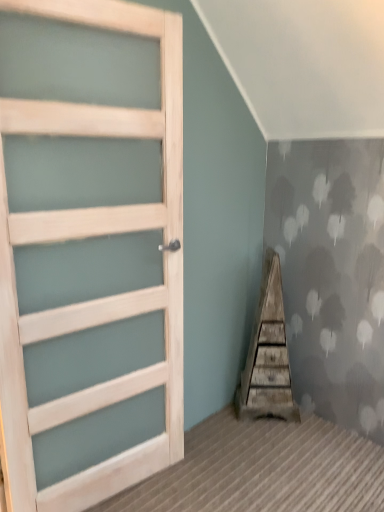
Describe the element at coordinates (268, 354) in the screenshot. I see `weathered wood stairwell at center` at that location.

This screenshot has width=384, height=512. Find the location of `weathered wood stairwell at center`. weathered wood stairwell at center is located at coordinates (268, 354).

In order to face light wood door at left, should I rotate leftwards or rightwards?

You should look left and rotate roughly 12.542 degrees.

This screenshot has height=512, width=384. What do you see at coordinates (89, 250) in the screenshot?
I see `light wood door at left` at bounding box center [89, 250].

Where is `light wood door at left`? light wood door at left is located at coordinates (89, 250).

What is the approximate height of light wood door at left?

The height of light wood door at left is 2.05 meters.

Where is `weathered wood stairwell at center`? The height and width of the screenshot is (512, 384). weathered wood stairwell at center is located at coordinates (268, 354).

Is weathered wood stairwell at center to the right of light wood door at left from the viewer's perspective?

Correct, you'll find weathered wood stairwell at center to the right of light wood door at left.

Does weathered wood stairwell at center lie behind light wood door at left?

Yes, the depth of weathered wood stairwell at center is greater than that of light wood door at left.

Is point (263, 304) closer or farther from the camera than point (68, 336)?

Point (263, 304) is positioned farther from the camera compared to point (68, 336).

From the image's perspective, is weathered wood stairwell at center on top of light wood door at left?

Incorrect, from the image's perspective, weathered wood stairwell at center is lower than light wood door at left.

From a real-world perspective, between weathered wood stairwell at center and light wood door at left, who is vertically higher?

light wood door at left.

Between weathered wood stairwell at center and light wood door at left, which one has smaller width?

With smaller width is light wood door at left.

Who is shorter, weathered wood stairwell at center or light wood door at left?

weathered wood stairwell at center.

Considering the sizes of objects weathered wood stairwell at center and light wood door at left in the image provided, who is smaller, weathered wood stairwell at center or light wood door at left?

weathered wood stairwell at center.

Would you say weathered wood stairwell at center is inside or outside light wood door at left?

The correct answer is: outside.

Looking at this image, is weathered wood stairwell at center with light wood door at left?

weathered wood stairwell at center is not next to light wood door at left, and they're not touching.

Could you tell me if weathered wood stairwell at center is turned towards light wood door at left?

No, weathered wood stairwell at center is not facing towards light wood door at left.

How different are the orientations of weathered wood stairwell at center and light wood door at left in degrees?

The angular difference between weathered wood stairwell at center and light wood door at left is 38.1 degrees.

In the scene shown: How much distance is there between weathered wood stairwell at center and light wood door at left?

weathered wood stairwell at center and light wood door at left are 35.83 inches apart.

Where is `stairwell located underneath the light wood door at left (from a real-world perspective)`? The height and width of the screenshot is (512, 384). stairwell located underneath the light wood door at left (from a real-world perspective) is located at coordinates (268, 354).

Which is more to the left, light wood door at left or weathered wood stairwell at center?

light wood door at left.

Which is behind, light wood door at left or weathered wood stairwell at center?

weathered wood stairwell at center is further from the camera.

Does point (44, 301) lie behind point (270, 294)?

No, (44, 301) is closer to viewer.

From the image's perspective, would you say light wood door at left is shown under weathered wood stairwell at center?

Actually, light wood door at left appears above weathered wood stairwell at center in the image.

From a real-world perspective, is light wood door at left on top of weathered wood stairwell at center?

Yes.

In terms of width, does light wood door at left look wider or thinner when compared to weathered wood stairwell at center?

Clearly, light wood door at left has less width compared to weathered wood stairwell at center.

Which of these two, light wood door at left or weathered wood stairwell at center, stands shorter?

weathered wood stairwell at center.

Between light wood door at left and weathered wood stairwell at center, which one has smaller size?

Smaller between the two is weathered wood stairwell at center.

Is light wood door at left outside of weathered wood stairwell at center?

Yes, light wood door at left is outside of weathered wood stairwell at center.

Are light wood door at left and weathered wood stairwell at center far apart?

light wood door at left is near weathered wood stairwell at center, not far away.

Does light wood door at left turn towards weathered wood stairwell at center?

No, light wood door at left is not facing towards weathered wood stairwell at center.

Where is `door above the weathered wood stairwell at center (from a real-world perspective)`? The image size is (384, 512). door above the weathered wood stairwell at center (from a real-world perspective) is located at coordinates (89, 250).

Where is `door above the weathered wood stairwell at center (from a real-world perspective)`? door above the weathered wood stairwell at center (from a real-world perspective) is located at coordinates (89, 250).

Locate an element on the screen. This screenshot has height=512, width=384. door located on the left of weathered wood stairwell at center is located at coordinates (89, 250).